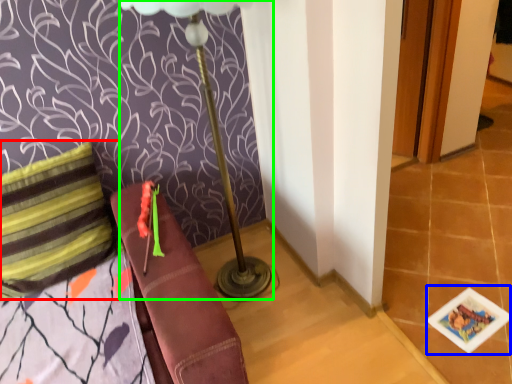
Question: Which object is the closest to the pillow (highlighted by a red box)? Choose among these: card game (highlighted by a blue box) or table lamp (highlighted by a green box).

Choices:
 (A) card game
 (B) table lamp

Answer: (B)